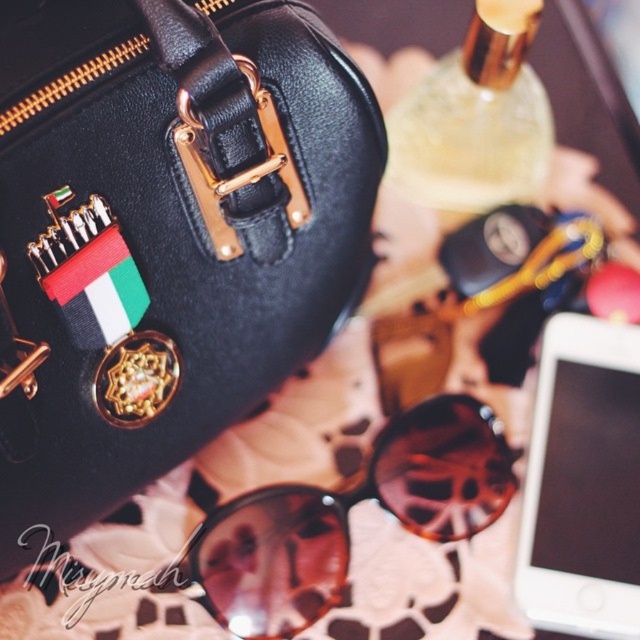
Question: Can you confirm if black leather handbag at upper left is positioned below brown matte sunglasses at center?

Choices:
 (A) yes
 (B) no

Answer: (B)

Question: Can you confirm if black leather handbag at upper left is positioned below brown matte sunglasses at center?

Choices:
 (A) yes
 (B) no

Answer: (B)

Question: Among these points, which one is nearest to the camera?

Choices:
 (A) (173, 154)
 (B) (588, 317)

Answer: (A)

Question: Which point is closer to the camera?

Choices:
 (A) brown matte sunglasses at center
 (B) white matte smartphone at lower right
 (C) black leather handbag at upper left

Answer: (C)

Question: Can you confirm if brown matte sunglasses at center is positioned to the right of white matte smartphone at lower right?

Choices:
 (A) no
 (B) yes

Answer: (A)

Question: Among these points, which one is farthest from the camera?

Choices:
 (A) (285, 540)
 (B) (202, 353)

Answer: (A)